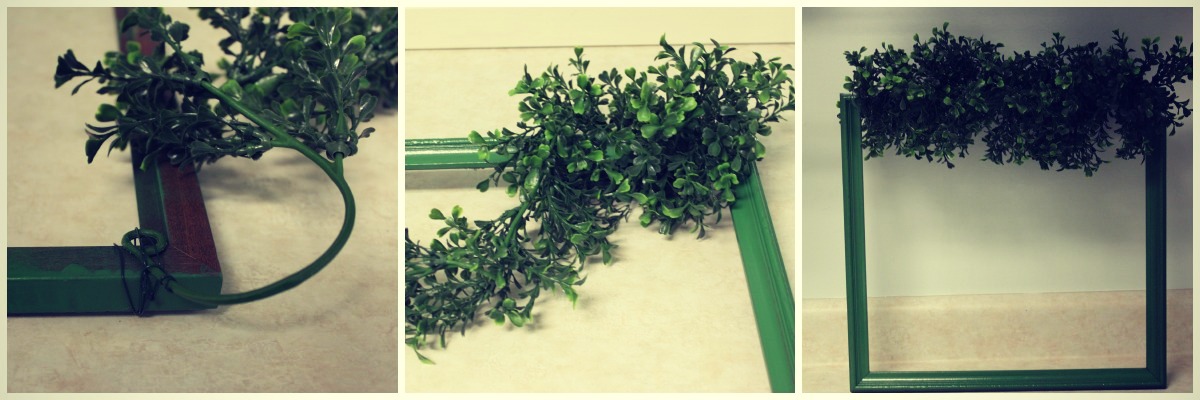
At what (x,y) coordinates should I click in order to perform the action: click on 1 frame on the left. Please return your answer as a coordinate pair (x, y). This screenshot has height=400, width=1200. Looking at the image, I should click on (172, 247).